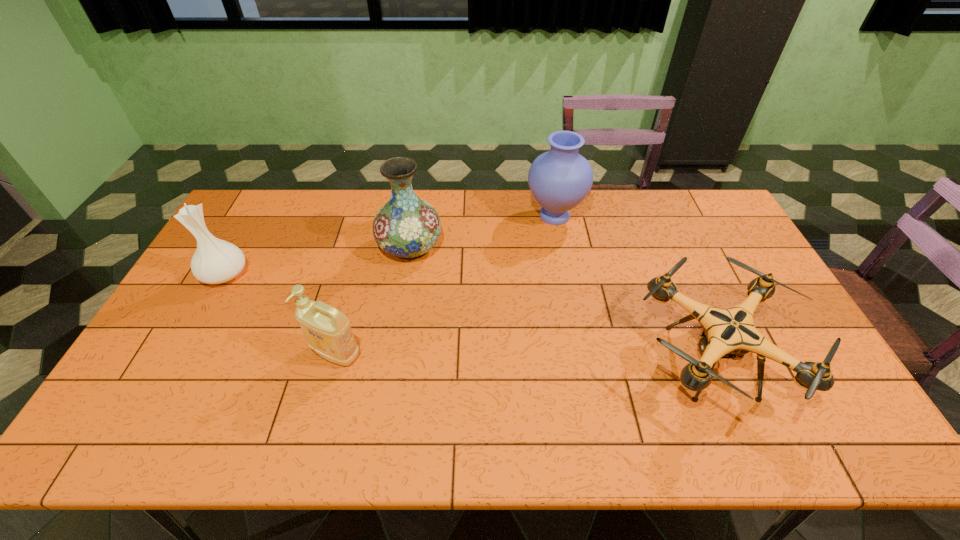
Locate an element on the screen. This screenshot has height=540, width=960. vacant space at the left edge of the desktop is located at coordinates (243, 288).

Locate an element on the screen. Image resolution: width=960 pixels, height=540 pixels. vacant region at the far right corner of the desktop is located at coordinates (680, 197).

At what (x,y) coordinates should I click in order to perform the action: click on vacant area between the second vase from left to right and the rightmost object. Please return your answer as a coordinate pair (x, y). This screenshot has width=960, height=540. Looking at the image, I should click on (560, 305).

At what (x,y) coordinates should I click in order to perform the action: click on vacant area between the rightmost vase and the second vase from left to right. Please return your answer as a coordinate pair (x, y). This screenshot has height=540, width=960. Looking at the image, I should click on (482, 232).

This screenshot has height=540, width=960. In order to click on free point between the rightmost vase and the detergent in this screenshot , I will do `click(445, 285)`.

This screenshot has width=960, height=540. Identify the location of free spot between the shortest object and the second vase from left to right. (560, 305).

Where is `free spot between the leftmost object and the rightmost object`? free spot between the leftmost object and the rightmost object is located at coordinates (468, 318).

Locate an element on the screen. The width and height of the screenshot is (960, 540). vacant area that lies between the leftmost vase and the drone is located at coordinates (468, 318).

Find the location of a particular element. free space between the shortest vase and the detergent is located at coordinates (280, 314).

At what (x,y) coordinates should I click in order to perform the action: click on vacant region between the fourth object from left to right and the second vase from left to right. Please return your answer as a coordinate pair (x, y). Image resolution: width=960 pixels, height=540 pixels. Looking at the image, I should click on (482, 232).